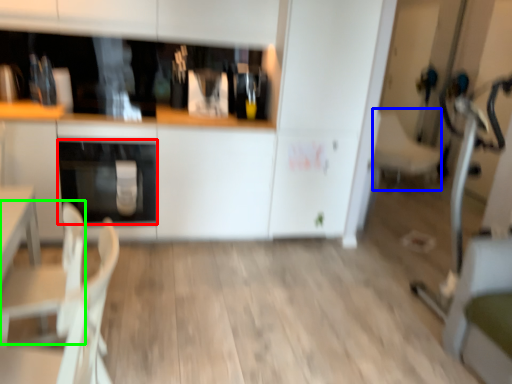
Question: Which object is the farthest from oven (highlighted by a red box)? Choose among these: armchair (highlighted by a blue box) or armchair (highlighted by a green box).

Choices:
 (A) armchair
 (B) armchair

Answer: (A)